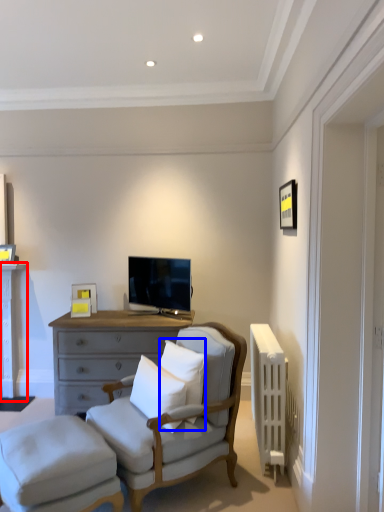
Question: Which point is closer to the camera, table (highlighted by a red box) or pillow (highlighted by a blue box)?

Choices:
 (A) table
 (B) pillow

Answer: (B)